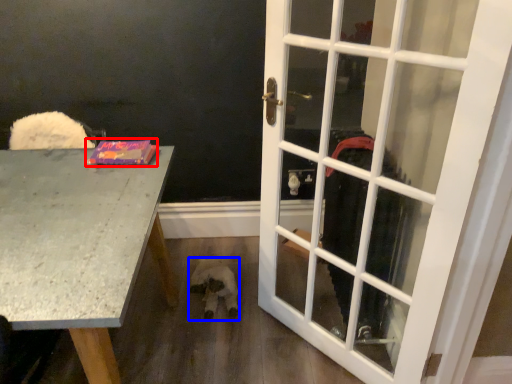
Question: Which object is closer to the camera taking this photo, book (highlighted by a red box) or animal (highlighted by a blue box)?

Choices:
 (A) book
 (B) animal

Answer: (A)